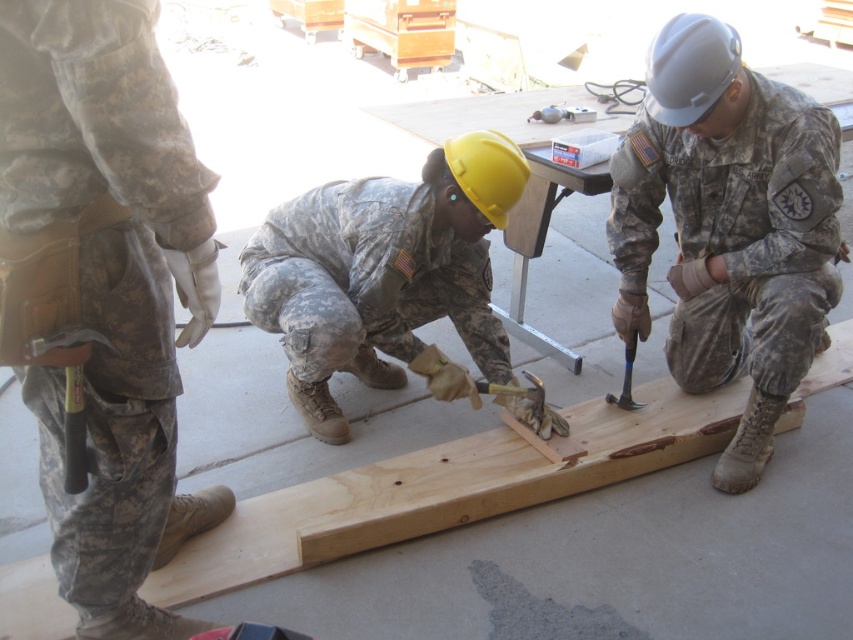
In the scene shown: What is located at the point with coordinates (103, 291) in the image?

The point at coordinates (103, 291) indicates camouflage fabric pants at center.

You are a safety inspector observing the construction activity. You notice two items at the center of the scene. Which item is taller, the camouflage fabric pants at center or the yellow matte helmet at center?

The camouflage fabric pants at center is much taller than the yellow matte helmet at center according to the description.